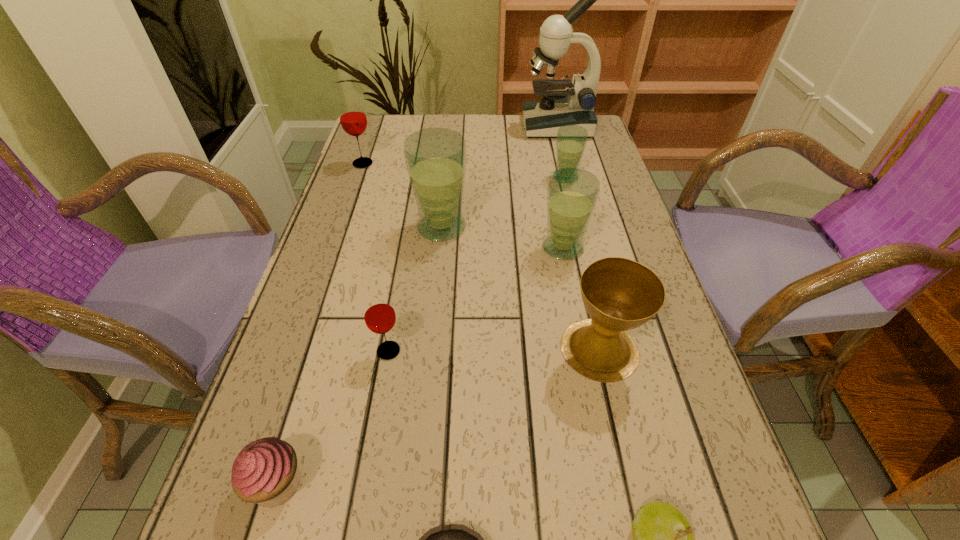
Where is `vacant space at the right edge of the desktop`? The height and width of the screenshot is (540, 960). vacant space at the right edge of the desktop is located at coordinates (678, 343).

The width and height of the screenshot is (960, 540). What are the coordinates of `vacant space at the far left corner of the desktop` in the screenshot? It's located at (368, 135).

I want to click on free space between the smallest blue glass and the pink cupcake, so click(x=421, y=330).

I want to click on free space between the nearer red glass and the brown chalice, so click(493, 350).

The image size is (960, 540). Identify the location of vacant space in between the pink cupcake and the farthest blue glass. (421, 330).

Identify the location of vacant space that is in between the brown chalice and the pink cupcake. (438, 416).

Identify the location of object that stands as the fourth closest to the brown chalice. coord(435,158).

Locate which object ranks sixth in proximity to the shortest object. Please provide its 2D coordinates. Your answer should be formatted as a tuple, i.e. [(x, y)], where the tuple contains the x and y coordinates of a point satisfying the conditions above.

[(435, 158)]

You are a GUI agent. You are given a task and a screenshot of the screen. Output one action in this format:
    pyautogui.click(x=<x>, y=<y>)
    Task: Click on the glass that can be found as the fifth closest to the green pear
    The image size is (960, 540).
    Given the screenshot: What is the action you would take?
    pyautogui.click(x=353, y=119)

Locate an element on the screen. Image resolution: width=960 pixels, height=540 pixels. the fourth closest glass to the tallest glass is located at coordinates (379, 314).